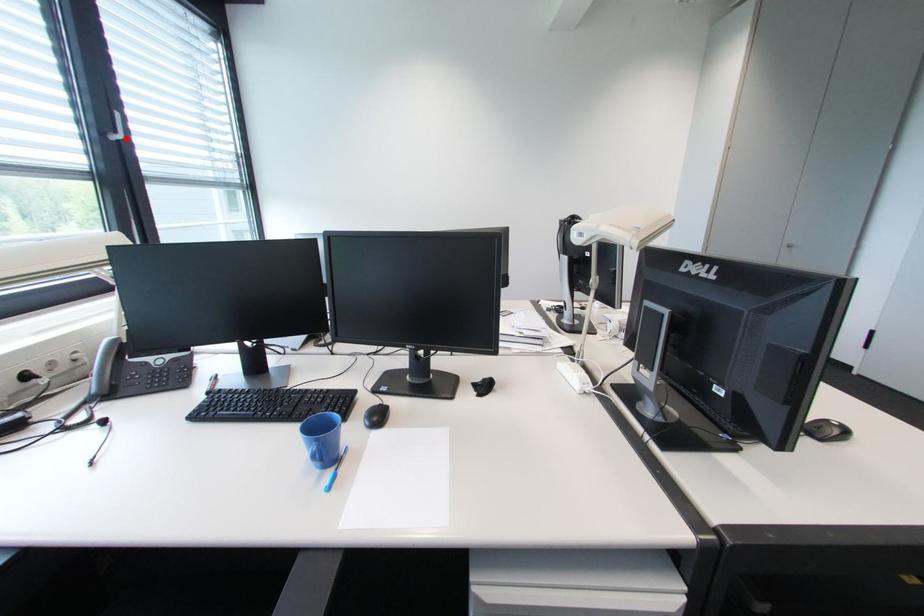
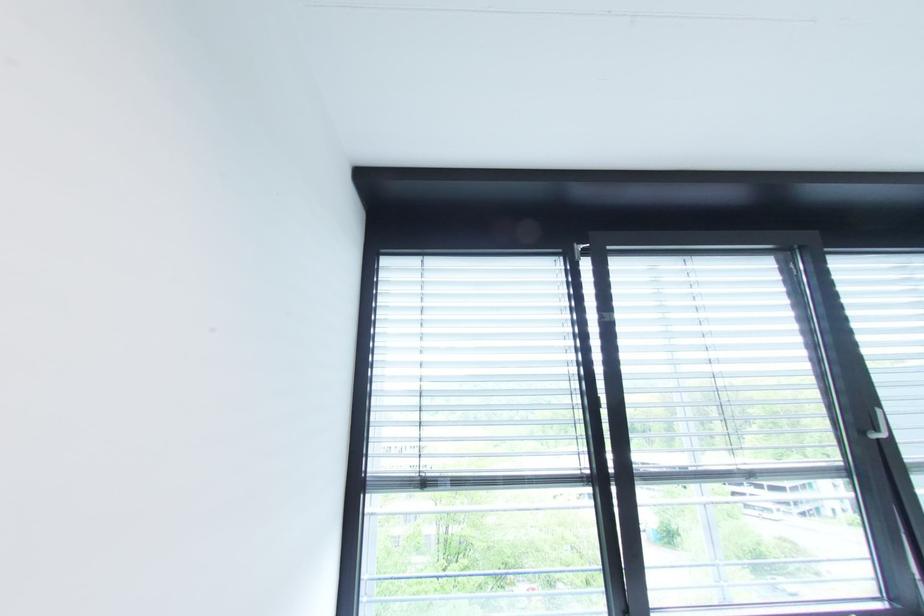
Question: I am providing you with two images of the same scene from different viewpoints. Given a red point in image1, look at the same physical point in image2. Is it:

Choices:
 (A) Closer to the viewpoint
 (B) Farther from the viewpoint

Answer: (A)